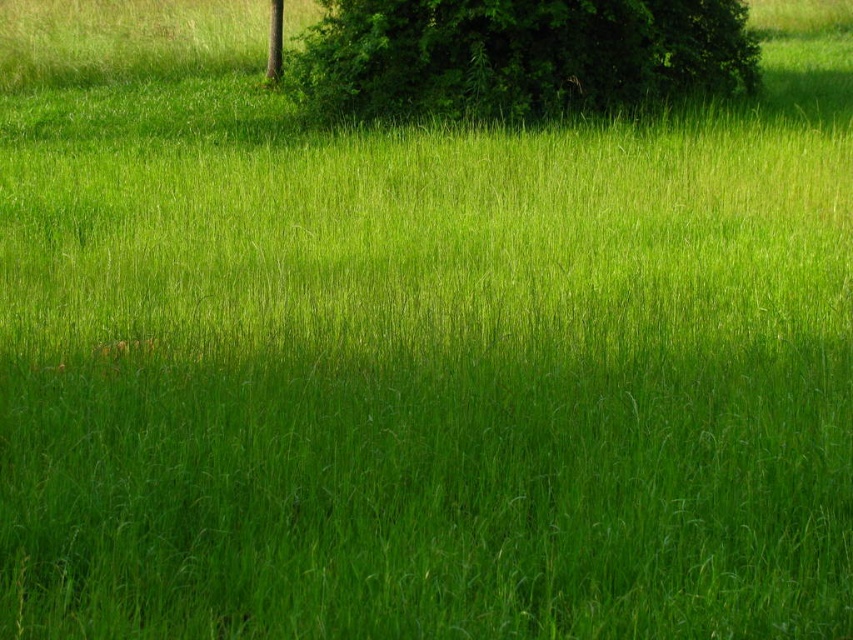
Between green leafy bush at upper center and smooth brown tree trunk at upper center, which one has less height?

green leafy bush at upper center

Is point (427, 99) farther from camera compared to point (273, 42)?

No.

At what (x,y) coordinates should I click in order to perform the action: click on green leafy bush at upper center. Please return your answer as a coordinate pair (x, y). Looking at the image, I should click on pyautogui.click(x=518, y=56).